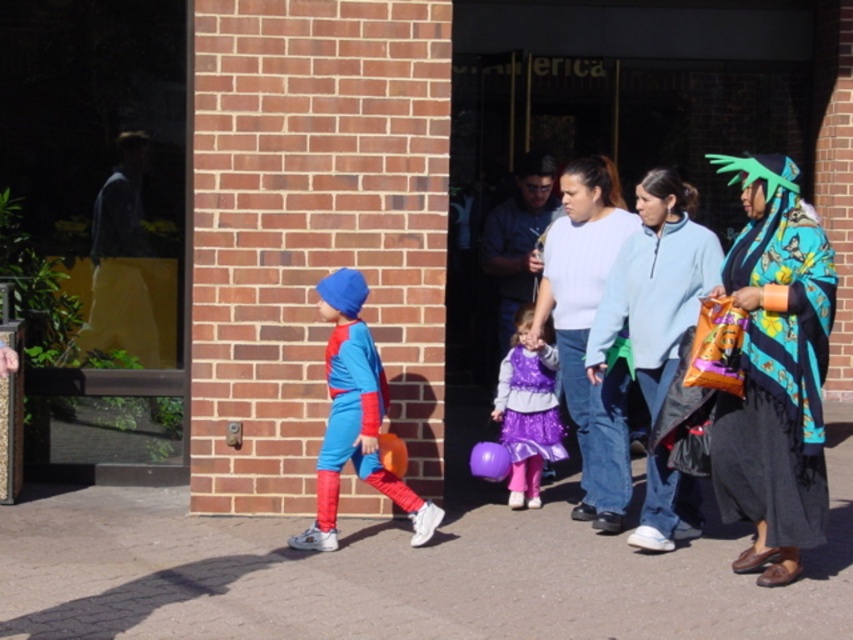
Question: Which object appears farthest from the camera in this image?

Choices:
 (A) printed silk shawl at right
 (B) multicolored fabric scarf at center

Answer: (A)

Question: Does light blue sweater at center appear on the right side of matte blue and red costume at left?

Choices:
 (A) no
 (B) yes

Answer: (B)

Question: From the image, what is the correct spatial relationship of matte blue and red costume at left in relation to purple satin dress at center?

Choices:
 (A) left
 (B) right

Answer: (A)

Question: Based on their relative distances, which object is farther from the multicolored fabric scarf at center?

Choices:
 (A) printed silk shawl at right
 (B) matte blue and red costume at left
 (C) purple satin dress at center

Answer: (B)

Question: In this image, where is multicolored fabric scarf at center located relative to light blue sweater at center?

Choices:
 (A) below
 (B) above

Answer: (A)

Question: Which of the following is the farthest from the observer?

Choices:
 (A) printed silk shawl at right
 (B) matte blue and red costume at left
 (C) light blue sweater at center
 (D) purple satin dress at center

Answer: (D)